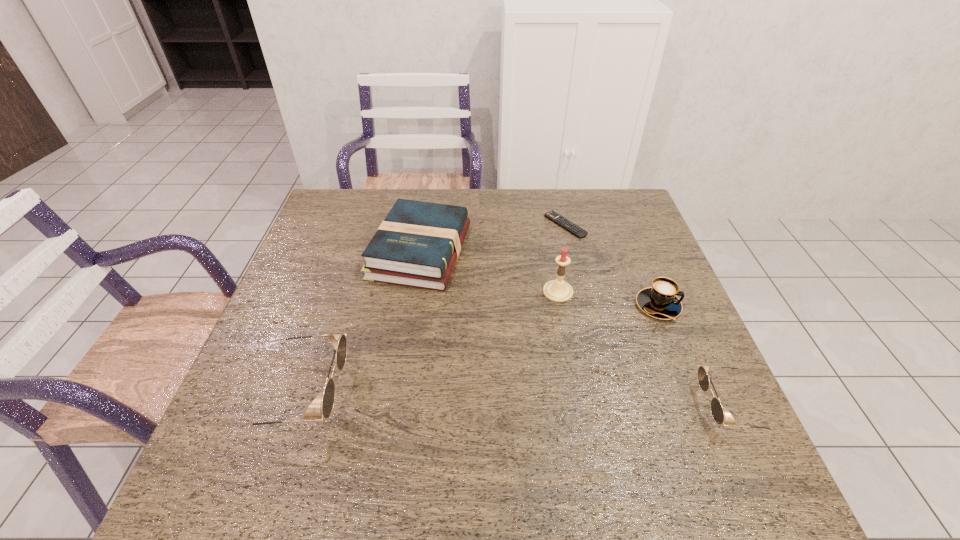
At what (x,y) coordinates should I click in order to perform the action: click on free space between the tallest object and the right sunglasses. Please return your answer as a coordinate pair (x, y). The image size is (960, 540). Looking at the image, I should click on (645, 349).

Where is `vacant area that lies between the left sunglasses and the shorter sunglasses`? vacant area that lies between the left sunglasses and the shorter sunglasses is located at coordinates (516, 399).

Where is `free space between the shortest object and the taller sunglasses`? free space between the shortest object and the taller sunglasses is located at coordinates (433, 309).

At what (x,y) coordinates should I click in order to perform the action: click on empty location between the shortest object and the cappuccino. Please return your answer as a coordinate pair (x, y). Looking at the image, I should click on (612, 265).

This screenshot has height=540, width=960. In order to click on free area in between the candle and the second tallest object in this screenshot , I will do `click(429, 342)`.

Where is `object that can be found as the third closest to the candle`? The image size is (960, 540). object that can be found as the third closest to the candle is located at coordinates (418, 243).

In order to click on the closest object to the fifth shortest object in this screenshot , I will do `click(418, 243)`.

I want to click on free point that satisfies the following two spatial constraints: 1. on the front side of the remote control; 2. on the front lenses of the left sunglasses, so click(x=605, y=393).